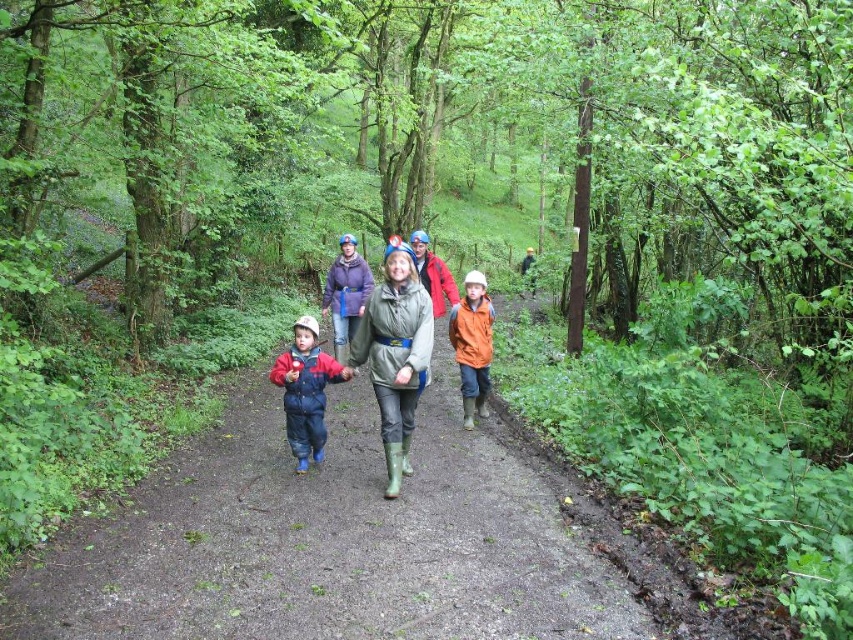
Question: Estimate the real-world distances between objects in this image. Which object is farther from the green rubber boots at center?

Choices:
 (A) orange matte jacket at center
 (B) matte orange jacket at center
 (C) matte blue jumpsuit at center

Answer: (A)

Question: Does matte blue jumpsuit at center lie in front of orange matte jacket at center?

Choices:
 (A) yes
 (B) no

Answer: (A)

Question: Can you confirm if green rubber boots at center is positioned above orange matte jacket at center?

Choices:
 (A) no
 (B) yes

Answer: (B)

Question: Is green rubber boots at center wider than matte blue jumpsuit at center?

Choices:
 (A) no
 (B) yes

Answer: (A)

Question: Among these objects, which one is nearest to the camera?

Choices:
 (A) orange matte jacket at center
 (B) green rubber boots at center
 (C) matte orange jacket at center

Answer: (C)

Question: Which object is the farthest from the matte orange jacket at center?

Choices:
 (A) orange matte jacket at center
 (B) green rubber boots at center
 (C) matte blue jumpsuit at center

Answer: (A)